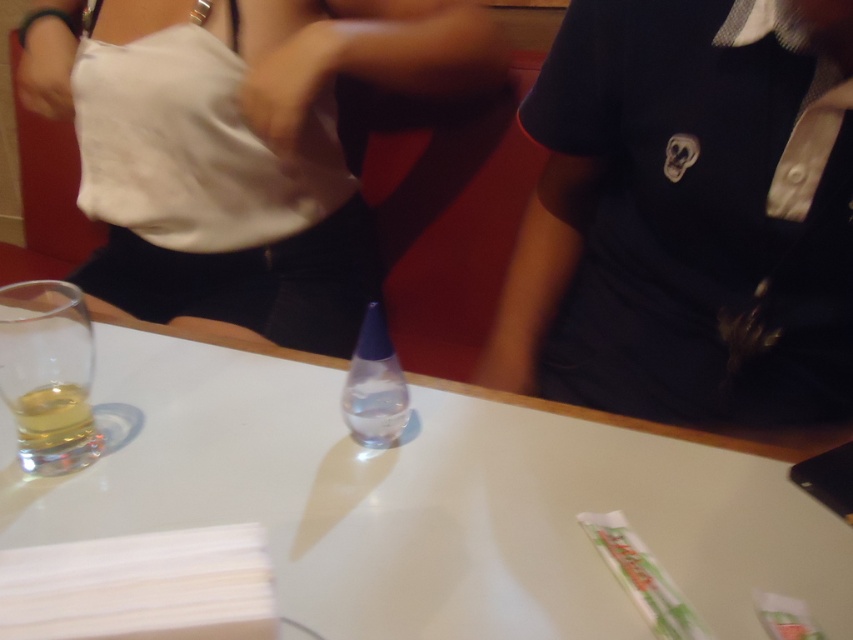
Question: Which of the following is the closest to the observer?

Choices:
 (A) (390, 413)
 (B) (44, 452)
 (C) (9, 381)
 (D) (178, 288)

Answer: (C)

Question: Which point is farther from the camera taking this photo?

Choices:
 (A) (656, 346)
 (B) (27, 420)
 (C) (144, 346)
 (D) (393, 397)

Answer: (A)

Question: Where is white matte tank top at upper left located in relation to translucent glass at left in the image?

Choices:
 (A) below
 (B) above

Answer: (B)

Question: Can you confirm if white matte tank top at upper left is positioned to the left of transparent glass at left?

Choices:
 (A) yes
 (B) no

Answer: (B)

Question: Which point is closer to the camera taking this photo?

Choices:
 (A) (369, 376)
 (B) (80, 388)

Answer: (B)

Question: Can you confirm if navy blue polo shirt at upper right is wider than translucent glass at left?

Choices:
 (A) no
 (B) yes

Answer: (B)